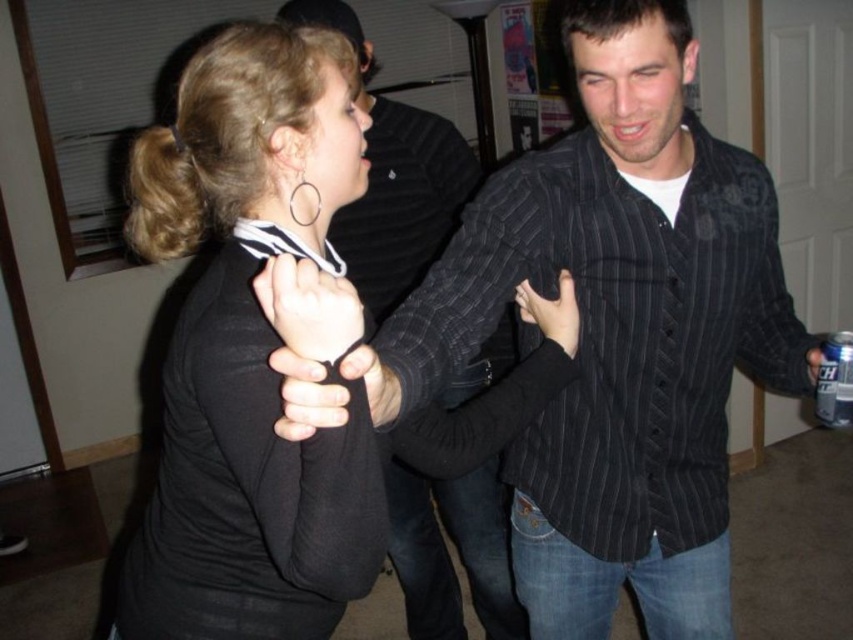
Between black matte shirt at upper left and black pinstripe shirt at center, which one appears on the left side from the viewer's perspective?

Positioned to the left is black matte shirt at upper left.

Which is in front, point (277, 138) or point (422, 221)?

Positioned in front is point (277, 138).

Locate an element on the screen. black matte shirt at upper left is located at coordinates (248, 353).

Is black matte shirt at upper left to the right of black matte glove at center from the viewer's perspective?

No, black matte shirt at upper left is not to the right of black matte glove at center.

Consider the image. Between black matte shirt at upper left and black matte glove at center, which one appears on the right side from the viewer's perspective?

From the viewer's perspective, black matte glove at center appears more on the right side.

Is point (276, 164) positioned behind point (288, 257)?

Yes, point (276, 164) is behind point (288, 257).

At what (x,y) coordinates should I click in order to perform the action: click on black matte shirt at upper left. Please return your answer as a coordinate pair (x, y). Looking at the image, I should click on (248, 353).

Is black matte glove at center further to the viewer compared to black matte hand at center?

No, black matte glove at center is in front of black matte hand at center.

Who is positioned more to the left, black matte glove at center or black matte hand at center?

Positioned to the left is black matte glove at center.

Is point (311, 298) positioned behind point (572, 333)?

No, it is in front of (572, 333).

Where is `black matte glove at center`? black matte glove at center is located at coordinates (309, 307).